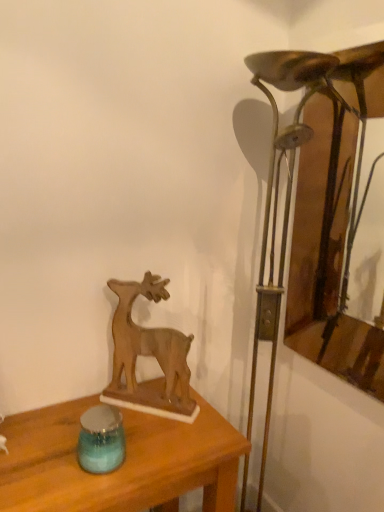
Question: Can you confirm if wooden frame at right is bigger than wooden table at center?

Choices:
 (A) no
 (B) yes

Answer: (A)

Question: Can you confirm if wooden frame at right is wider than wooden table at center?

Choices:
 (A) yes
 (B) no

Answer: (B)

Question: From a real-world perspective, is wooden frame at right beneath wooden table at center?

Choices:
 (A) no
 (B) yes

Answer: (A)

Question: Would you say wooden frame at right is a long distance from wooden table at center?

Choices:
 (A) yes
 (B) no

Answer: (B)

Question: Is wooden table at center completely or partially inside wooden frame at right?

Choices:
 (A) no
 (B) yes

Answer: (A)

Question: Is the depth of wooden frame at right less than that of wooden table at center?

Choices:
 (A) no
 (B) yes

Answer: (A)

Question: Can you confirm if wooden deer at center is thinner than bronze metallic table lamp at right?

Choices:
 (A) no
 (B) yes

Answer: (B)

Question: Are wooden deer at center and bronze metallic table lamp at right beside each other?

Choices:
 (A) no
 (B) yes

Answer: (A)

Question: From a real-world perspective, does wooden deer at center sit lower than bronze metallic table lamp at right?

Choices:
 (A) no
 (B) yes

Answer: (A)

Question: Considering the relative sizes of wooden deer at center and bronze metallic table lamp at right in the image provided, is wooden deer at center wider than bronze metallic table lamp at right?

Choices:
 (A) yes
 (B) no

Answer: (B)

Question: Is wooden deer at center turned away from bronze metallic table lamp at right?

Choices:
 (A) yes
 (B) no

Answer: (B)

Question: Can you confirm if wooden deer at center is positioned to the left of bronze metallic table lamp at right?

Choices:
 (A) yes
 (B) no

Answer: (A)

Question: Can you confirm if wooden table at center is shorter than bronze metallic table lamp at right?

Choices:
 (A) yes
 (B) no

Answer: (A)